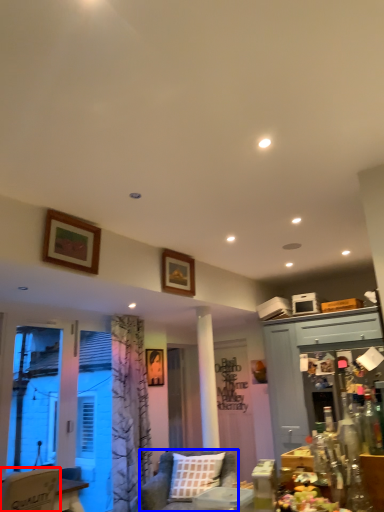
Question: Which object appears closest to the camera in this image, chair (highlighted by a red box) or studio couch (highlighted by a blue box)?

Choices:
 (A) chair
 (B) studio couch

Answer: (A)